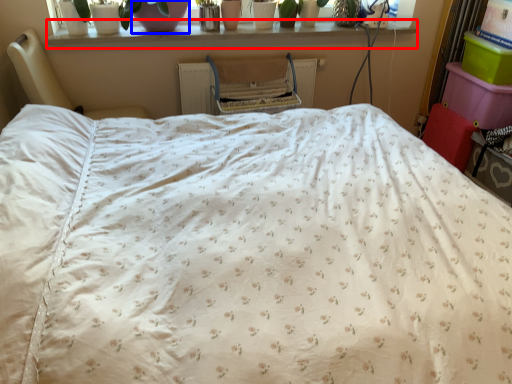
Question: Which object is closer to the camera taking this photo, window sill (highlighted by a red box) or glass vase (highlighted by a blue box)?

Choices:
 (A) window sill
 (B) glass vase

Answer: (B)